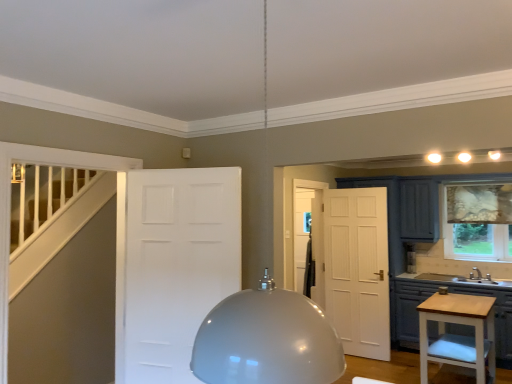
Question: Is white matte door at center positioned behind matte gray cabinets at lower right?

Choices:
 (A) yes
 (B) no

Answer: (B)

Question: Can you confirm if white matte door at center is positioned to the left of matte gray cabinets at lower right?

Choices:
 (A) yes
 (B) no

Answer: (A)

Question: Is white matte door at center smaller than matte gray cabinets at lower right?

Choices:
 (A) yes
 (B) no

Answer: (A)

Question: From a real-world perspective, is white matte door at center on top of matte gray cabinets at lower right?

Choices:
 (A) yes
 (B) no

Answer: (A)

Question: Can you confirm if white matte door at center is positioned to the right of matte gray cabinets at lower right?

Choices:
 (A) no
 (B) yes

Answer: (A)

Question: Does white matte door at center contain matte gray cabinets at lower right?

Choices:
 (A) no
 (B) yes

Answer: (A)

Question: Does matte gray cabinets at lower right have a smaller size compared to patterned fabric curtain at right?

Choices:
 (A) no
 (B) yes

Answer: (A)

Question: From a real-world perspective, is matte gray cabinets at lower right on top of patterned fabric curtain at right?

Choices:
 (A) no
 (B) yes

Answer: (A)

Question: Is matte gray cabinets at lower right in contact with patterned fabric curtain at right?

Choices:
 (A) no
 (B) yes

Answer: (A)

Question: Can you confirm if matte gray cabinets at lower right is taller than patterned fabric curtain at right?

Choices:
 (A) no
 (B) yes

Answer: (A)

Question: Is the position of matte gray cabinets at lower right less distant than that of patterned fabric curtain at right?

Choices:
 (A) no
 (B) yes

Answer: (B)

Question: Is matte gray cabinets at lower right at the left side of patterned fabric curtain at right?

Choices:
 (A) yes
 (B) no

Answer: (A)

Question: Can you confirm if matte gray cabinets at lower right is smaller than light wood vanity at lower right?

Choices:
 (A) yes
 (B) no

Answer: (B)